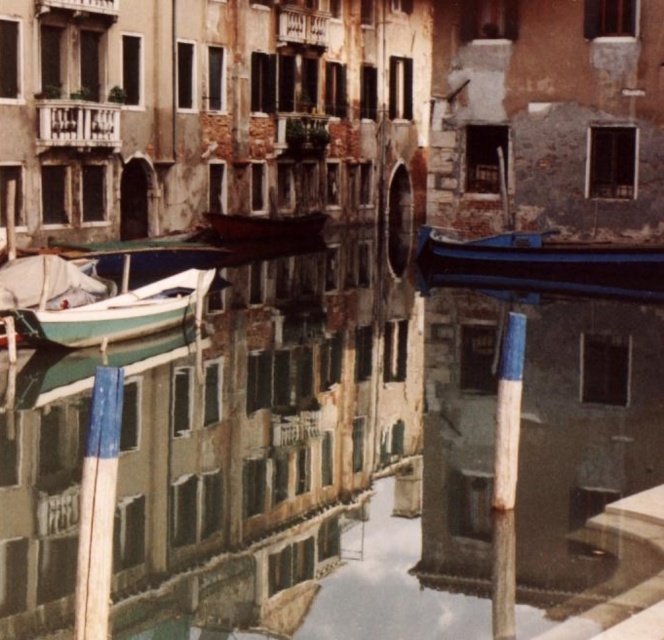
You are standing on a bridge overlooking the smooth concrete canal at center and the green matte boat at left. Which object is nearer to you?

The smooth concrete canal at center is closer to the viewer than the green matte boat at left, so the smooth concrete canal at center is nearer to you.

You are standing on the bank of the canal and want to place a small statue that is 2 meters tall. Considering the height of the smooth concrete canal at center and the green matte boat at left, which object can the statue fit under without touching it?

The statue can fit under the smooth concrete canal at center because it is much taller than the green matte boat at left, so the statue would not touch the canal but might hit the boat if placed under it.

You are a tour guide leading a group along the canal. You want to explain how the canal accommodates the boats. Based on the scene, can you confirm if the smooth concrete canal at center is wider than the blue glossy boat at right?

Yes, the smooth concrete canal at center is wider than the blue glossy boat at right because the canal width surpasses the boat width.